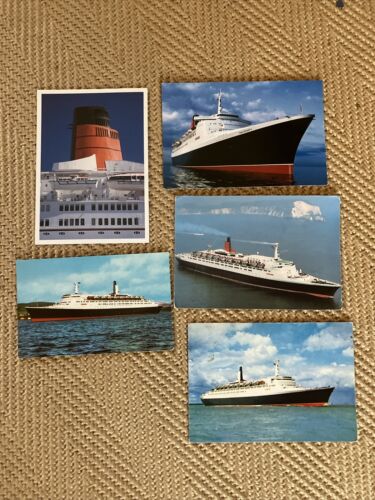
Locate an element on the screen. The height and width of the screenshot is (500, 375). photographs on the left is located at coordinates (116, 315), (109, 181).